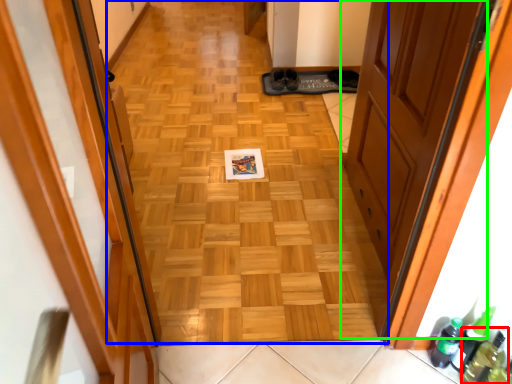
Question: Which object is positioned farthest from bottle (highlighted by a red box)? Select from plain (highlighted by a blue box) and door (highlighted by a green box).

Choices:
 (A) plain
 (B) door

Answer: (A)